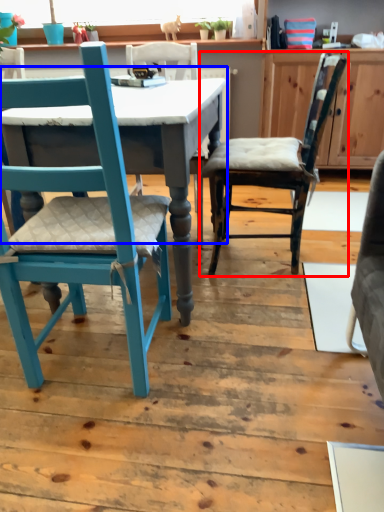
Question: Among these objects, which one is nearest to the camera, chair (highlighted by a red box) or table (highlighted by a blue box)?

Choices:
 (A) chair
 (B) table

Answer: (B)